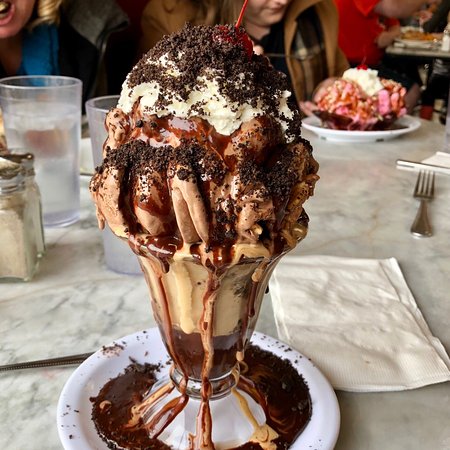
Locate an element on the screen. clear plastic cup is located at coordinates (38, 95), (95, 116).